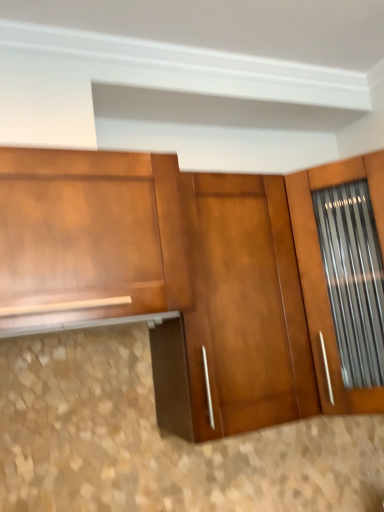
Question: Does shiny brown cabinet at left have a greater height compared to glossy wood door at center?

Choices:
 (A) no
 (B) yes

Answer: (A)

Question: Is shiny brown cabinet at left outside glossy wood door at center?

Choices:
 (A) no
 (B) yes

Answer: (B)

Question: Is shiny brown cabinet at left in front of glossy wood door at center?

Choices:
 (A) no
 (B) yes

Answer: (B)

Question: Does shiny brown cabinet at left lie behind glossy wood door at center?

Choices:
 (A) no
 (B) yes

Answer: (A)

Question: Can you confirm if shiny brown cabinet at left is wider than glossy wood door at center?

Choices:
 (A) yes
 (B) no

Answer: (A)

Question: From the image's perspective, would you say shiny brown cabinet at left is shown under glossy wood door at center?

Choices:
 (A) no
 (B) yes

Answer: (A)

Question: Is glossy wood door at center aimed at shiny brown cabinet at left?

Choices:
 (A) yes
 (B) no

Answer: (B)

Question: From a real-world perspective, is glossy wood door at center below shiny brown cabinet at left?

Choices:
 (A) yes
 (B) no

Answer: (A)

Question: Is glossy wood door at center smaller than shiny brown cabinet at left?

Choices:
 (A) yes
 (B) no

Answer: (B)

Question: Is glossy wood door at center in contact with shiny brown cabinet at left?

Choices:
 (A) no
 (B) yes

Answer: (A)

Question: Is glossy wood door at center to the left of shiny brown cabinet at left from the viewer's perspective?

Choices:
 (A) yes
 (B) no

Answer: (B)

Question: From a real-world perspective, is glossy wood door at center on top of shiny brown cabinet at left?

Choices:
 (A) no
 (B) yes

Answer: (A)

Question: Is shiny brown cabinet at left in front of or behind glossy wood door at center in the image?

Choices:
 (A) front
 (B) behind

Answer: (A)